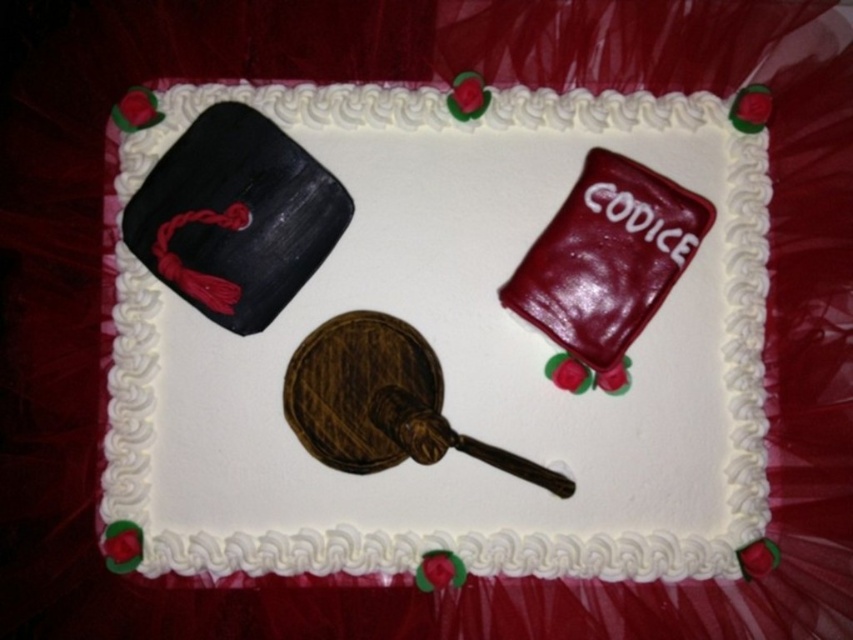
You are a guest at a graduation party and see the rectangular sheet cake with decorations. The cake has a black graduation cap with a red tassel on the left side, a gavel in the center right, and a red book with white text on the right of the gavel. If you were to place a candle exactly at point coordinates (456, 353), where would it be relative to the matte black hat at upper left?

The point coordinates (456, 353) indicate the exact location of the matte black hat at upper left, so placing a candle there would position it directly on top of the matte black hat at upper left.

You are a cake decorator who needs to place a 7 inch wide ribbon between the matte black hat at upper left and the shiny black hat at upper left on the cake. Can you fit it there?

The distance between the matte black hat at upper left and the shiny black hat at upper left is 6.86 inches, so the 7 inch wide ribbon cannot fit between them since it is slightly wider than the available space.